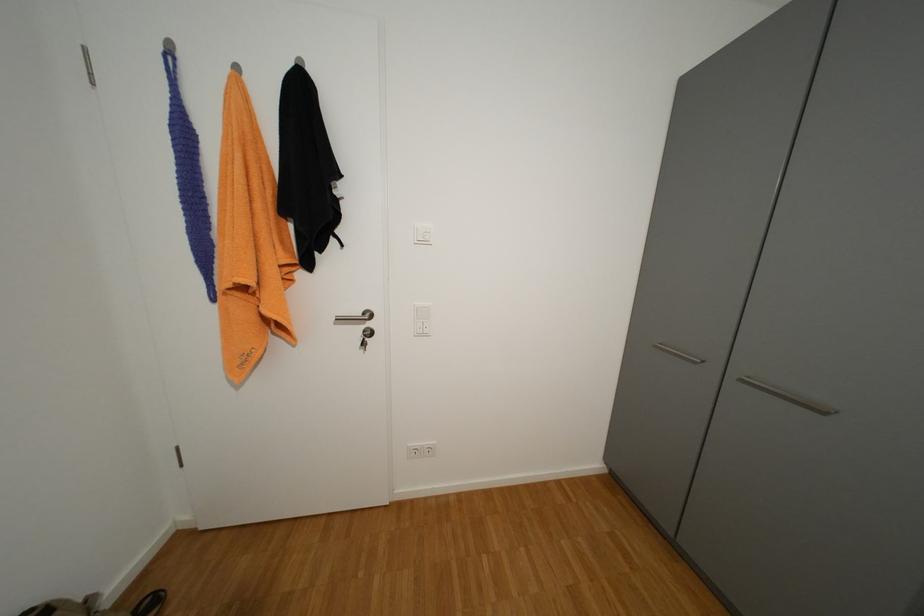
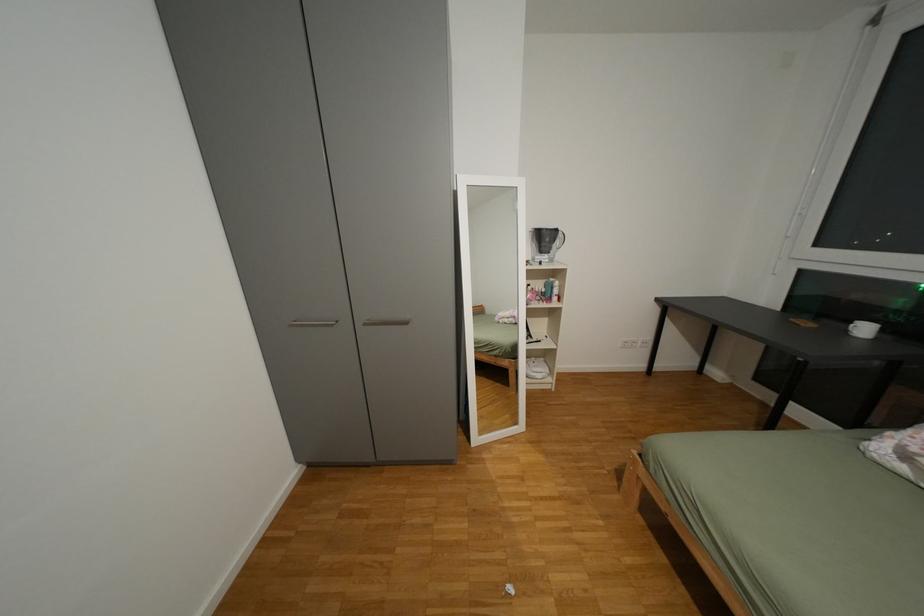
The first image is from the beginning of the video and the second image is from the end. How did the camera likely rotate when shooting the video?

The rotation direction of the camera is right-down.